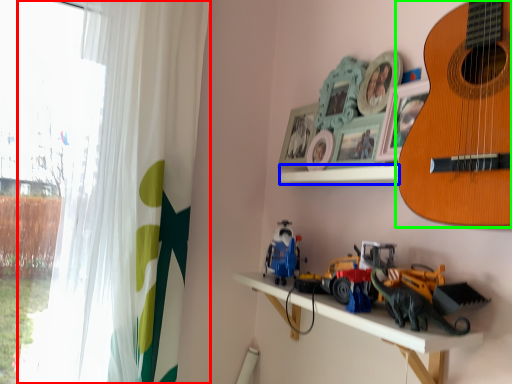
Question: Which object is the farthest from curtain (highlighted by a red box)? Choose among these: window sill (highlighted by a blue box) or guitar (highlighted by a green box).

Choices:
 (A) window sill
 (B) guitar

Answer: (B)